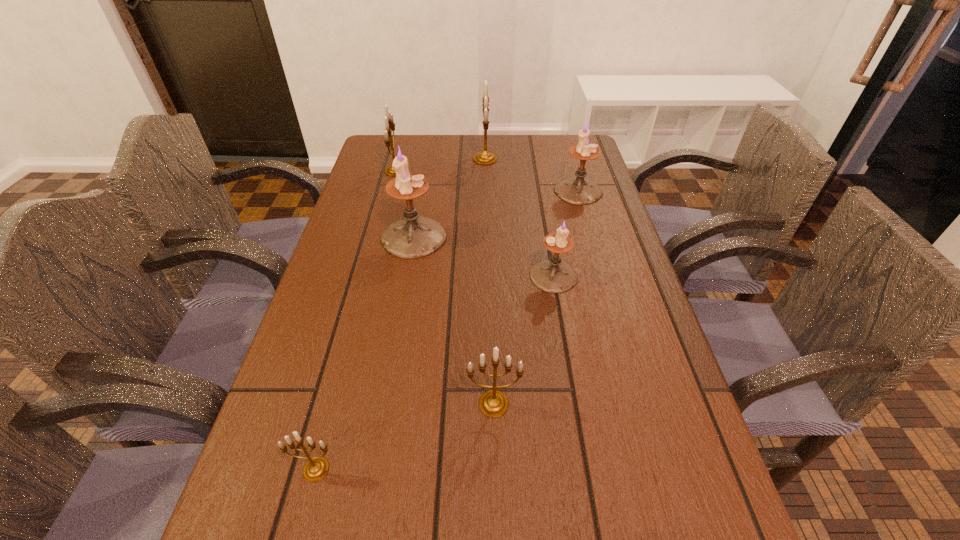
The image size is (960, 540). What are the coordinates of `candelabrum identified as the closest to the smallest purple candle holder` in the screenshot? It's located at (415, 236).

Locate which candelabrum is the fourth closest to the nearest object. Please provide its 2D coordinates. Your answer should be formatted as a tuple, i.e. [(x, y)], where the tuple contains the x and y coordinates of a point satisfying the conditions above.

[(577, 190)]

Identify which purple candle holder is located as the third nearest to the shortest object. Please provide its 2D coordinates. Your answer should be formatted as a tuple, i.e. [(x, y)], where the tuple contains the x and y coordinates of a point satisfying the conditions above.

[(577, 190)]

Identify which purple candle holder is located as the second nearest to the leftmost purple candle holder. Please provide its 2D coordinates. Your answer should be formatted as a tuple, i.e. [(x, y)], where the tuple contains the x and y coordinates of a point satisfying the conditions above.

[(577, 190)]

Identify the location of gold candelabrum that stands as the closest to the shortest object. (493, 403).

At what (x,y) coordinates should I click in order to perform the action: click on gold candelabrum identified as the second closest to the biggest purple candle holder. Please return your answer as a coordinate pair (x, y). The width and height of the screenshot is (960, 540). Looking at the image, I should click on (483, 158).

Find the location of a particular element. The image size is (960, 540). vacant space that satisfies the following two spatial constraints: 1. on the back side of the second smallest gold candelabrum; 2. on the right side of the farthest purple candle holder is located at coordinates pyautogui.click(x=489, y=191).